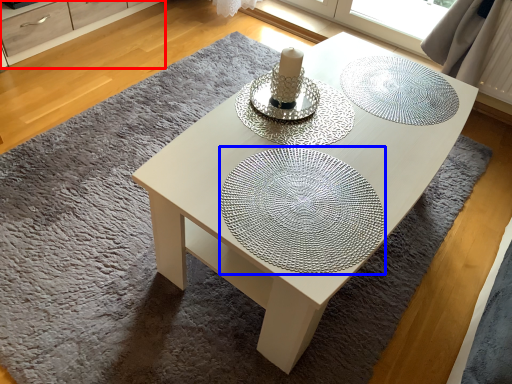
Question: Which object appears farthest to the camera in this image, dresser (highlighted by a red box) or glass plate (highlighted by a blue box)?

Choices:
 (A) dresser
 (B) glass plate

Answer: (A)